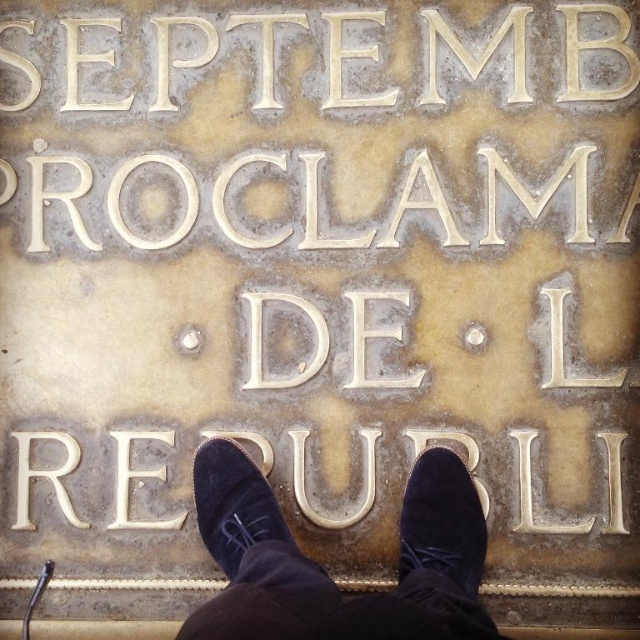
Question: Can you confirm if suede shoes at center is positioned below suede shoe at center?

Choices:
 (A) no
 (B) yes

Answer: (B)

Question: Which object is closer to the camera taking this photo?

Choices:
 (A) suede shoe at center
 (B) suede shoes at center

Answer: (B)

Question: Which object appears farthest from the camera in this image?

Choices:
 (A) suede shoes at center
 (B) velvet-like dark blue shoe at lower center

Answer: (B)

Question: Where is suede shoes at center located in relation to suede shoe at center in the image?

Choices:
 (A) below
 (B) above

Answer: (A)

Question: Does velvet-like dark blue shoe at lower center have a smaller size compared to suede shoe at center?

Choices:
 (A) yes
 (B) no

Answer: (A)

Question: Which of these objects is positioned closest to the suede shoes at center?

Choices:
 (A) suede shoe at center
 (B) velvet-like dark blue shoe at lower center

Answer: (A)